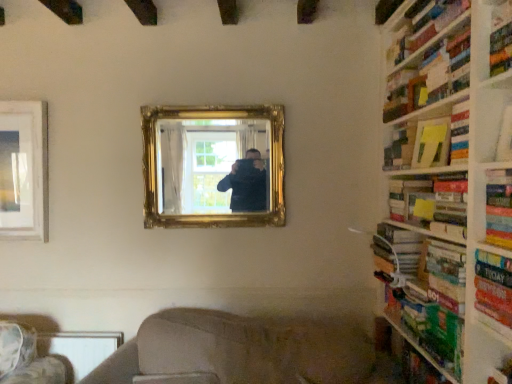
Question: Does wooden bookshelf at right appear on the right side of green matte book at right, positioned as the sixth book in top-to-bottom order?

Choices:
 (A) yes
 (B) no

Answer: (A)

Question: Considering the relative sizes of wooden bookshelf at right and green matte book at right, positioned as the sixth book in top-to-bottom order, in the image provided, is wooden bookshelf at right taller than green matte book at right, positioned as the sixth book in top-to-bottom order,?

Choices:
 (A) no
 (B) yes

Answer: (B)

Question: Is wooden bookshelf at right looking in the opposite direction of green matte book at right, positioned as the sixth book in top-to-bottom order?

Choices:
 (A) yes
 (B) no

Answer: (A)

Question: Is wooden bookshelf at right at the left side of green matte book at right, positioned as the sixth book in top-to-bottom order?

Choices:
 (A) no
 (B) yes

Answer: (A)

Question: Could you tell me if wooden bookshelf at right is turned towards green matte book at right, positioned as the sixth book in top-to-bottom order?

Choices:
 (A) yes
 (B) no

Answer: (A)

Question: In terms of width, does hardcover book at right, the third book in the bottom-to-top sequence, look wider or thinner when compared to gold ornate mirror at center?

Choices:
 (A) wide
 (B) thin

Answer: (A)

Question: From the image's perspective, is hardcover book at right, the third book in the bottom-to-top sequence, positioned above or below gold ornate mirror at center?

Choices:
 (A) below
 (B) above

Answer: (A)

Question: From a real-world perspective, relative to gold ornate mirror at center, is hardcover book at right, the third book in the bottom-to-top sequence, vertically above or below?

Choices:
 (A) above
 (B) below

Answer: (B)

Question: Is hardcover book at right, which is the fourth book from top to bottom, spatially inside gold ornate mirror at center, or outside of it?

Choices:
 (A) inside
 (B) outside

Answer: (B)

Question: Considering the positions of hardcover book at upper right, acting as the sixth book starting from the bottom, and wooden bookshelf at right in the image, is hardcover book at upper right, acting as the sixth book starting from the bottom, taller or shorter than wooden bookshelf at right?

Choices:
 (A) short
 (B) tall

Answer: (A)

Question: In terms of size, does hardcover book at upper right, acting as the sixth book starting from the bottom, appear bigger or smaller than wooden bookshelf at right?

Choices:
 (A) small
 (B) big

Answer: (A)

Question: Does point (409, 112) appear closer or farther from the camera than point (453, 362)?

Choices:
 (A) closer
 (B) farther

Answer: (B)

Question: Would you say hardcover book at upper right, acting as the sixth book starting from the bottom, is to the left or to the right of wooden bookshelf at right in the picture?

Choices:
 (A) left
 (B) right

Answer: (A)

Question: Would you say hardcover book at right, the third book in the bottom-to-top sequence, is inside or outside green cardboard bookshelf at right, which ranks as the 3th shelf in top-to-bottom order?

Choices:
 (A) outside
 (B) inside

Answer: (A)

Question: Considering the positions of point (475, 266) and point (408, 342), is point (475, 266) closer or farther from the camera than point (408, 342)?

Choices:
 (A) farther
 (B) closer

Answer: (B)